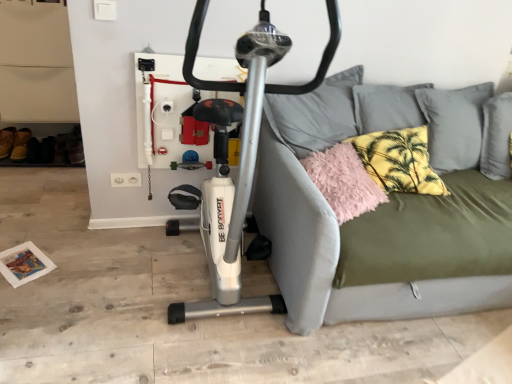
The image size is (512, 384). I want to click on free space that is to the left of silver metallic stationary bicycle at center, so click(94, 278).